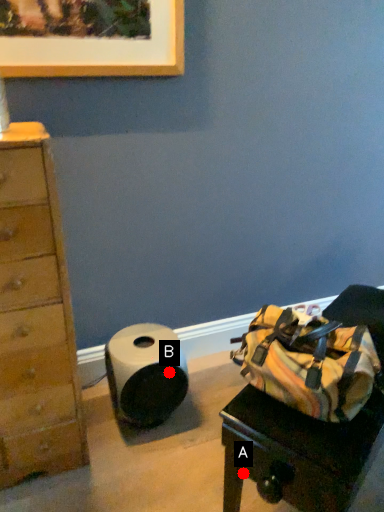
Question: Two points are circled on the image, labeled by A and B beside each circle. Among these points, which one is farthest from the camera?

Choices:
 (A) A is further
 (B) B is further

Answer: (B)